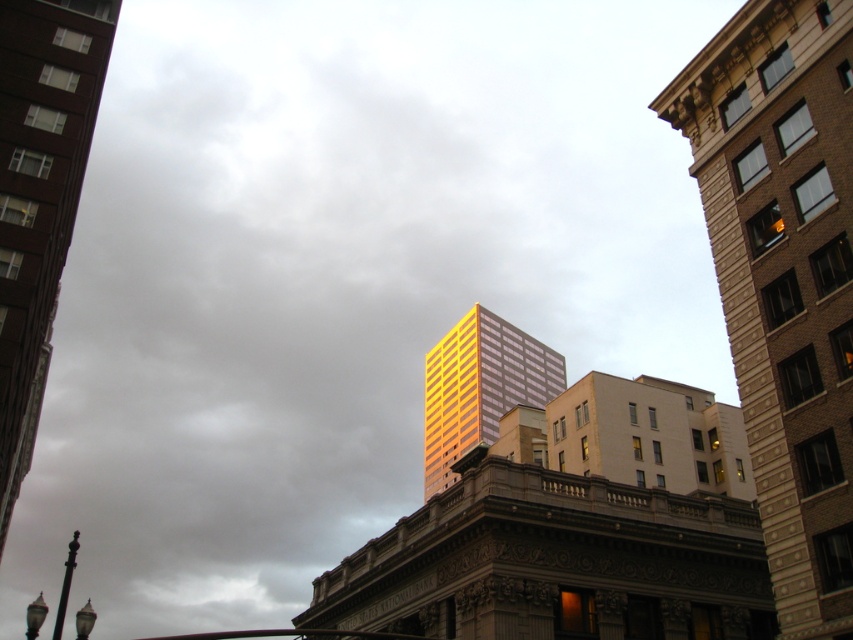
You are a drone operator tasked with flying a drone between the gold reflective glass skyscraper at center and the gold reflective glass building at center. The drone has a maximum flight distance of 120 meters. Can the drone safely travel between these two structures without exceeding its range?

The distance between the gold reflective glass skyscraper at center and the gold reflective glass building at center is 117.90 meters, which is under the drone operator maximum flight distance of 120 meters. Therefore, the drone can safely travel between them without exceeding its range.

You are a drone operator tasked with flying a drone between the gold glass skyscraper at center and the gold reflective glass skyscraper at center. The drone has a wingspan of 1.5 meters. Can the drone safely navigate the space between them?

The gold glass skyscraper at center is 164.22 feet away from the gold reflective glass skyscraper at center. Since the distance between them is much larger than the drone wingspan of 1.5 meters, the drone can safely navigate the space between them.